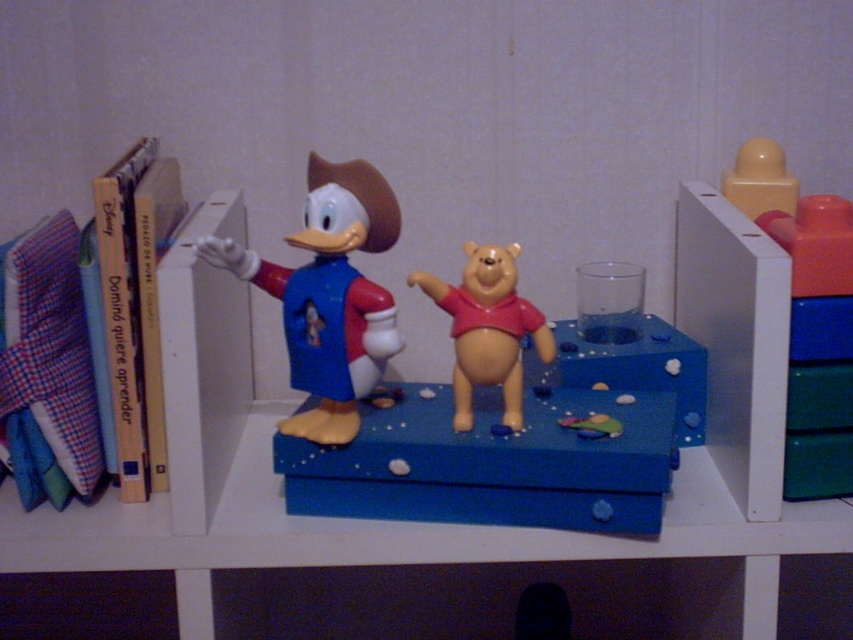
Question: Among these objects, which one is farthest from the camera?

Choices:
 (A) rubber duck at center
 (B) yellow matte block at upper right
 (C) rubberized plastic block at right
 (D) smooth yellow bear at center

Answer: (B)

Question: Estimate the real-world distances between objects in this image. Which object is closer to the rubber duck at center?

Choices:
 (A) rubberized plastic block at right
 (B) smooth yellow bear at center
 (C) yellow matte block at upper right

Answer: (B)

Question: Does matte plastic duck at center have a larger size compared to rubberized plastic block at right?

Choices:
 (A) no
 (B) yes

Answer: (B)

Question: Does matte plastic duck at center have a lesser width compared to rubberized plastic block at right?

Choices:
 (A) no
 (B) yes

Answer: (A)

Question: Can you confirm if matte plastic duck at center is smaller than rubberized plastic block at right?

Choices:
 (A) no
 (B) yes

Answer: (A)

Question: Which point is closer to the camera?

Choices:
 (A) (804, 220)
 (B) (460, 292)

Answer: (A)